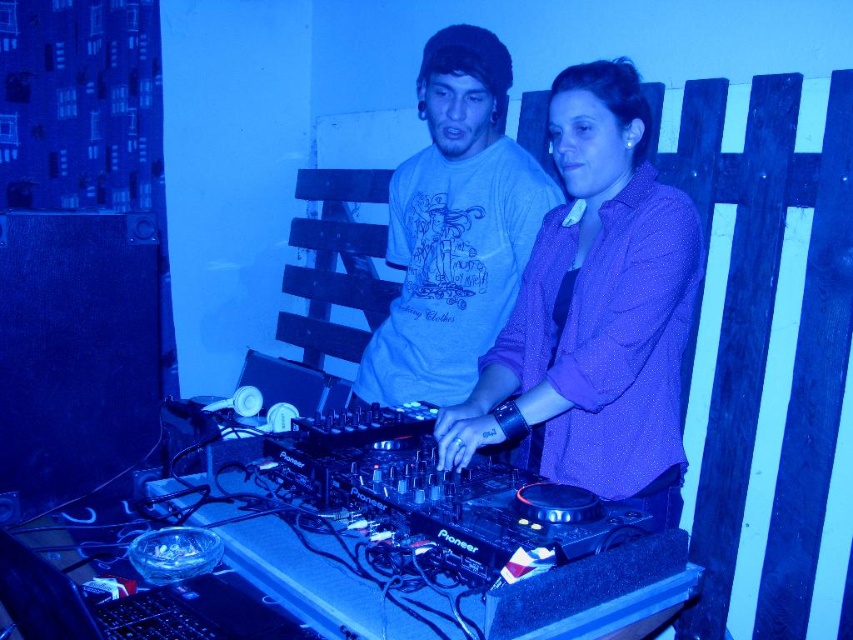
Does purple dotted shirt at center appear on the right side of matte blue t-shirt at center?

Correct, you'll find purple dotted shirt at center to the right of matte blue t-shirt at center.

Between point (537, 248) and point (450, 397), which one is positioned in front?

Point (537, 248) is in front.

Identify the location of purple dotted shirt at center. (596, 310).

The height and width of the screenshot is (640, 853). Find the location of `purple dotted shirt at center`. purple dotted shirt at center is located at coordinates (596, 310).